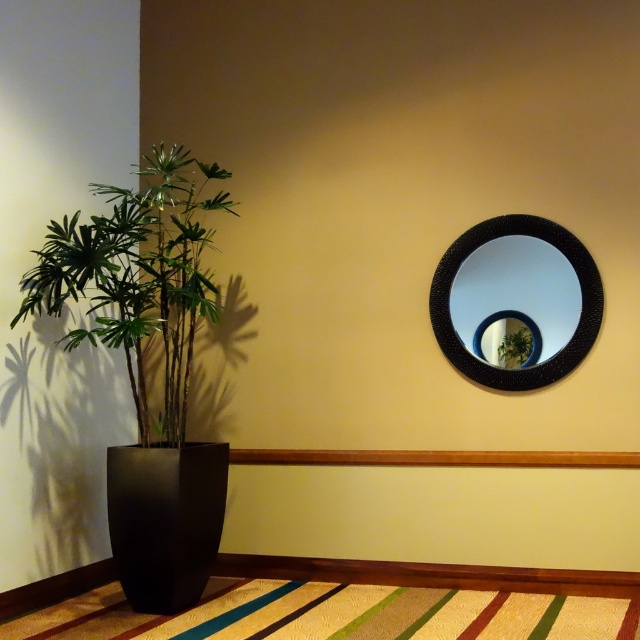
Question: Estimate the real-world distances between objects in this image. Which object is closer to the black textured mirror at upper right?

Choices:
 (A) green matte plant at left
 (B) green leafy plant at upper right
 (C) striped carpet at lower center

Answer: (B)

Question: Is green matte plant at left thinner than black textured mirror at upper right?

Choices:
 (A) no
 (B) yes

Answer: (A)

Question: Which of the following is the closest to the observer?

Choices:
 (A) (538, 352)
 (B) (58, 240)
 (C) (260, 588)
 (D) (465, 282)

Answer: (B)

Question: From the image, what is the correct spatial relationship of striped carpet at lower center in relation to black matte vase at left?

Choices:
 (A) above
 (B) below

Answer: (B)

Question: Does green matte plant at left have a smaller size compared to striped carpet at lower center?

Choices:
 (A) no
 (B) yes

Answer: (A)

Question: Among these points, which one is farthest from the camera?

Choices:
 (A) (593, 620)
 (B) (472, 324)
 (C) (195, 524)

Answer: (B)